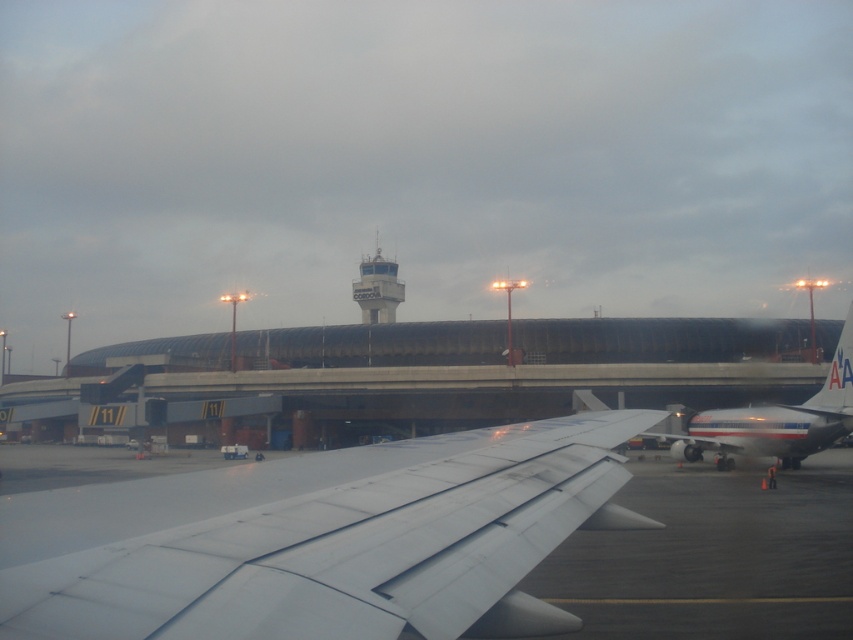
You are a pilot preparing for takeoff and need to check the distance between the white glossy airplane at right and the white concrete control tower at center. Can you determine if the airplane is closer to you than the control tower?

The white glossy airplane at right is in front of the white concrete control tower at center, so the airplane is closer to you than the control tower.

You are a passenger waiting at gate 11. You see the white matte wing at center and the white glossy airplane at right. Which one is positioned higher from the ground?

The white matte wing at center is located above the white glossy airplane at right, so it is positioned higher from the ground.